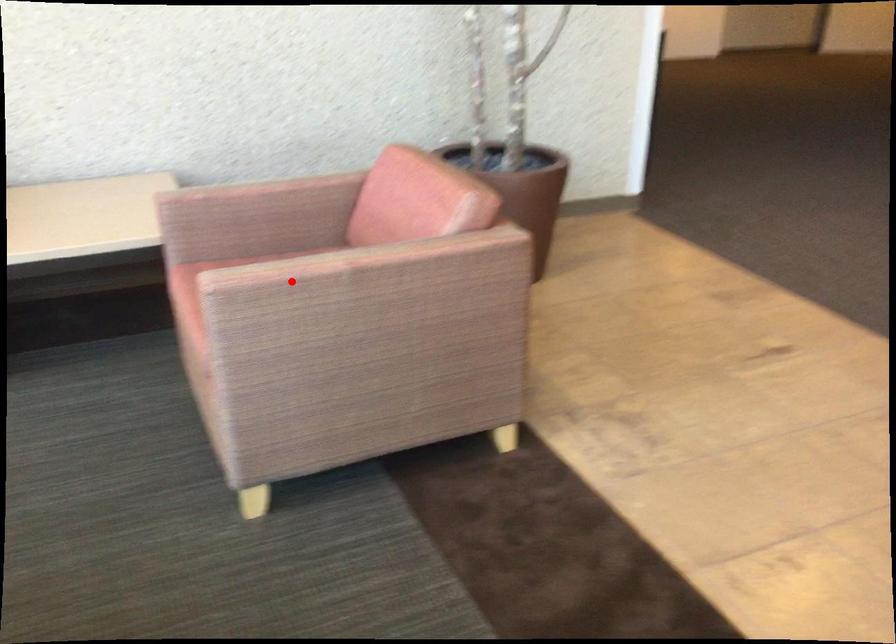
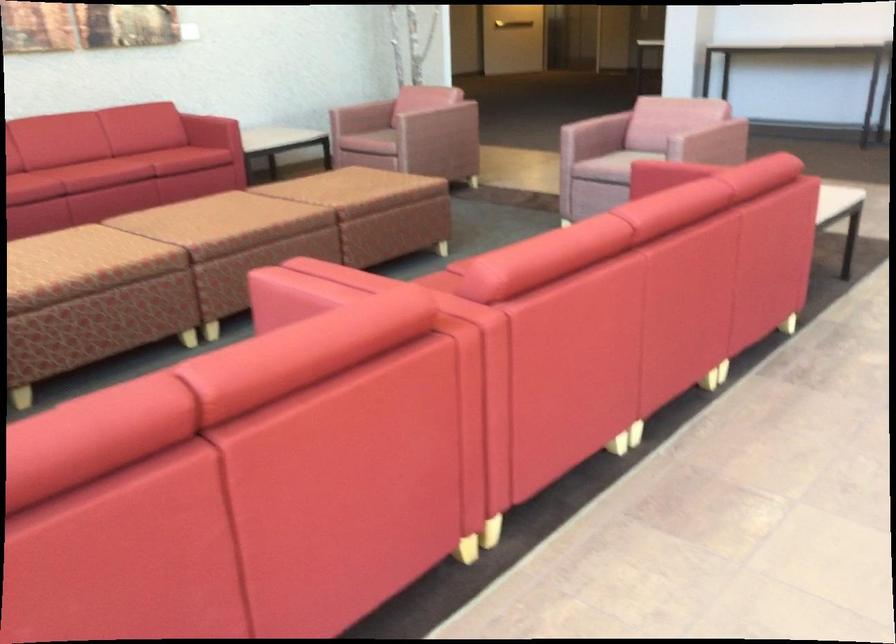
Find the pixel in the second image that matches the highlighted location in the first image.

(431, 106)